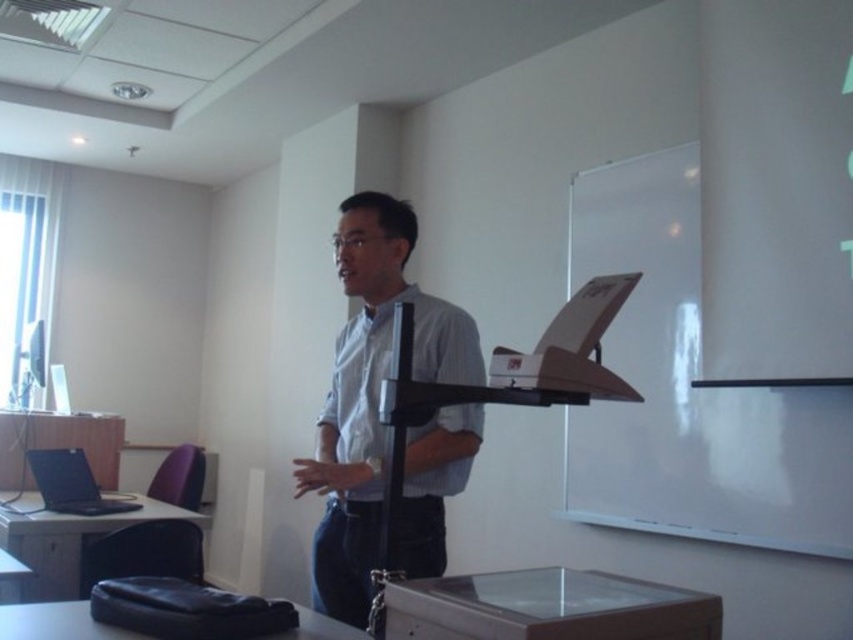
Question: Which point is closer to the camera?

Choices:
 (A) light blue shirt at center
 (B) white matte board at upper right

Answer: (A)

Question: Does white matte board at upper right appear on the left side of light blue shirt at center?

Choices:
 (A) yes
 (B) no

Answer: (B)

Question: Is white matte board at upper right to the right of light blue shirt at center from the viewer's perspective?

Choices:
 (A) yes
 (B) no

Answer: (A)

Question: Does white matte board at upper right have a lesser width compared to light blue shirt at center?

Choices:
 (A) no
 (B) yes

Answer: (A)

Question: Which point is farther from the camera taking this photo?

Choices:
 (A) (668, 304)
 (B) (482, 406)

Answer: (A)